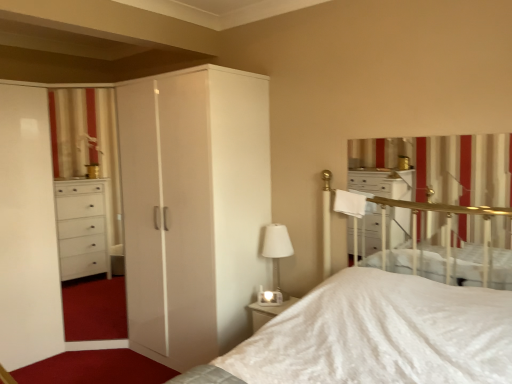
Locate an element on the screen. This screenshot has width=512, height=384. free spot above white striped curtain at upper right (from a real-world perspective) is located at coordinates (428, 133).